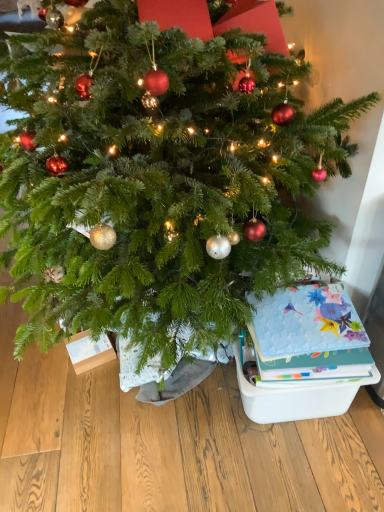
Measure the distance between point (344, 372) and camera.

They are 4.01 feet apart.

Where is `floral paper card at lower right`? floral paper card at lower right is located at coordinates (309, 335).

Describe the element at coordinates (309, 335) in the screenshot. This screenshot has height=512, width=384. I see `floral paper card at lower right` at that location.

What do you see at coordinates (293, 398) in the screenshot? I see `matte plastic storage box at lower right` at bounding box center [293, 398].

Locate an element on the screen. This screenshot has width=384, height=512. matte plastic storage box at lower right is located at coordinates (293, 398).

Locate an element on the screen. The height and width of the screenshot is (512, 384). floral paper card at lower right is located at coordinates (309, 335).

Which is more to the right, matte plastic storage box at lower right or floral paper card at lower right?

matte plastic storage box at lower right.

Based on the photo, which object is further away from the camera taking this photo, matte plastic storage box at lower right or floral paper card at lower right?

Positioned behind is matte plastic storage box at lower right.

Which is closer, (272,388) or (276,328)?

Point (272,388).

From the image's perspective, is matte plastic storage box at lower right on top of floral paper card at lower right?

Incorrect, from the image's perspective, matte plastic storage box at lower right is lower than floral paper card at lower right.

From a real-world perspective, who is located lower, matte plastic storage box at lower right or floral paper card at lower right?

matte plastic storage box at lower right.

Does matte plastic storage box at lower right have a greater width compared to floral paper card at lower right?

Indeed, matte plastic storage box at lower right has a greater width compared to floral paper card at lower right.

Who is taller, matte plastic storage box at lower right or floral paper card at lower right?

matte plastic storage box at lower right.

Who is smaller, matte plastic storage box at lower right or floral paper card at lower right?

With smaller size is floral paper card at lower right.

Would you say matte plastic storage box at lower right is inside or outside floral paper card at lower right?

matte plastic storage box at lower right exists outside the volume of floral paper card at lower right.

Is matte plastic storage box at lower right far from floral paper card at lower right?

No, matte plastic storage box at lower right is not far from floral paper card at lower right.

Is matte plastic storage box at lower right oriented towards floral paper card at lower right?

No, matte plastic storage box at lower right is not aimed at floral paper card at lower right.

Where is `christmas card in front of the matte plastic storage box at lower right`? christmas card in front of the matte plastic storage box at lower right is located at coordinates (309, 335).

Does floral paper card at lower right appear on the left side of matte plastic storage box at lower right?

Yes.

Is floral paper card at lower right in front of or behind matte plastic storage box at lower right in the image?

floral paper card at lower right is in front of matte plastic storage box at lower right.

Does point (357, 371) lie behind point (313, 410)?

No, it is not.

From the image's perspective, would you say floral paper card at lower right is positioned over matte plastic storage box at lower right?

Yes, from the image's perspective, floral paper card at lower right is over matte plastic storage box at lower right.

From a real-world perspective, relative to matte plastic storage box at lower right, is floral paper card at lower right vertically above or below?

In terms of real-world spatial position, floral paper card at lower right is above matte plastic storage box at lower right.

Between floral paper card at lower right and matte plastic storage box at lower right, which one has larger width?

With larger width is matte plastic storage box at lower right.

Is floral paper card at lower right shorter than matte plastic storage box at lower right?

Yes, floral paper card at lower right is shorter than matte plastic storage box at lower right.

Considering the sizes of objects floral paper card at lower right and matte plastic storage box at lower right in the image provided, who is bigger, floral paper card at lower right or matte plastic storage box at lower right?

matte plastic storage box at lower right is bigger.

Is floral paper card at lower right not inside matte plastic storage box at lower right?

Yes, floral paper card at lower right is located beyond the bounds of matte plastic storage box at lower right.

Can you see floral paper card at lower right touching matte plastic storage box at lower right?

There is a gap between floral paper card at lower right and matte plastic storage box at lower right.

Does floral paper card at lower right turn towards matte plastic storage box at lower right?

No, floral paper card at lower right is not oriented towards matte plastic storage box at lower right.

What's the angular difference between floral paper card at lower right and matte plastic storage box at lower right's facing directions?

92.3 degrees separate the facing orientations of floral paper card at lower right and matte plastic storage box at lower right.

How much distance is there between floral paper card at lower right and matte plastic storage box at lower right?

They are 5.96 inches apart.

The height and width of the screenshot is (512, 384). In order to click on storage box beneath the floral paper card at lower right (from a real-world perspective) in this screenshot , I will do `click(293, 398)`.

Identify the location of christmas card in front of the matte plastic storage box at lower right. This screenshot has width=384, height=512. (309, 335).

The image size is (384, 512). Identify the location of christmas card that appears on the left of matte plastic storage box at lower right. coord(309,335).